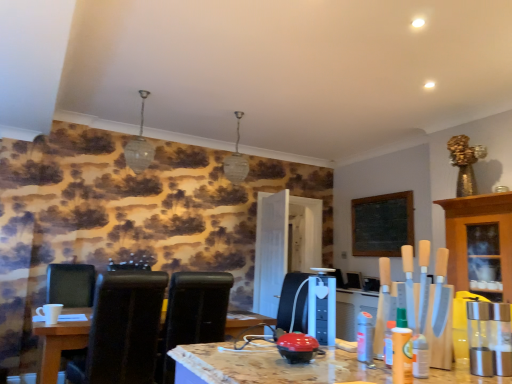
Question: From the image's perspective, relative to wooden cabinet at right, is wooden table at lower left above or below?

Choices:
 (A) below
 (B) above

Answer: (A)

Question: Would you say wooden table at lower left is to the left or to the right of wooden cabinet at right in the picture?

Choices:
 (A) right
 (B) left

Answer: (B)

Question: Estimate the real-world distances between objects in this image. Which object is farther from the black leather chair at lower left, the 1th chair from the left?

Choices:
 (A) wooden table at lower left
 (B) wooden cabinet at right
 (C) black leather chair at center, placed as the 3th chair when sorted from left to right
 (D) black leather chair at left, arranged as the 2th chair when viewed from the left

Answer: (B)

Question: Which is nearer to the wooden table at lower left?

Choices:
 (A) black leather chair at left, placed as the 2th chair when sorted from right to left
 (B) black leather chair at center, placed as the 1th chair when sorted from right to left
 (C) wooden cabinet at right
 (D) black leather chair at lower left, the 1th chair from the left

Answer: (A)